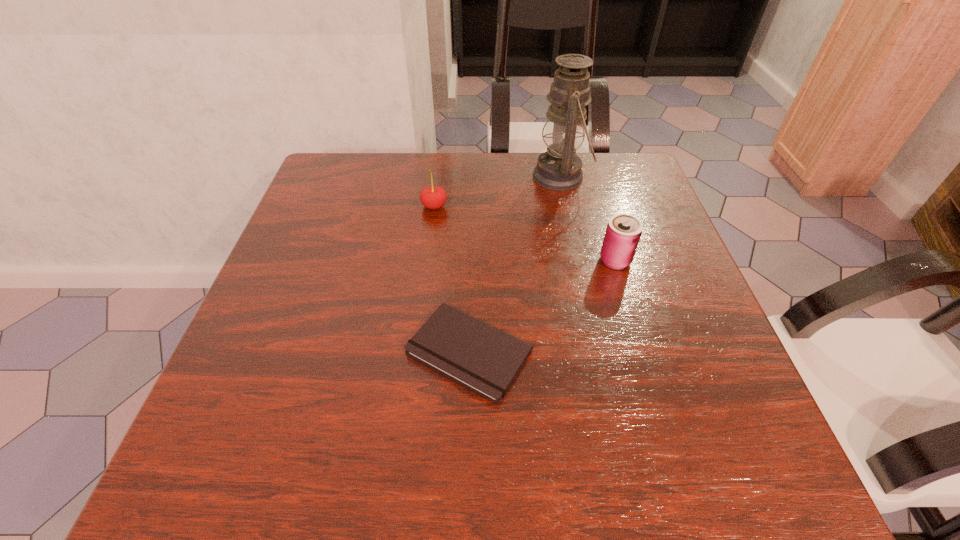
The image size is (960, 540). In order to click on the tallest object in this screenshot , I will do `click(559, 168)`.

I want to click on cherry, so click(x=433, y=197).

Find the location of a particular element. The height and width of the screenshot is (540, 960). can is located at coordinates (623, 232).

You are a GUI agent. You are given a task and a screenshot of the screen. Output one action in this format:
    pyautogui.click(x=<x>, y=<y>)
    Task: Click on the checkbook
    This screenshot has height=540, width=960.
    Given the screenshot: What is the action you would take?
    pyautogui.click(x=486, y=360)

This screenshot has width=960, height=540. I want to click on the shortest object, so click(x=486, y=360).

Where is `blank space located on the front of the oil lamp`? The image size is (960, 540). blank space located on the front of the oil lamp is located at coordinates (589, 303).

Where is `blank space located on the left of the cherry`? Image resolution: width=960 pixels, height=540 pixels. blank space located on the left of the cherry is located at coordinates (330, 206).

Find the location of a particular element. vacant space located 0.330m on the left of the third farthest object is located at coordinates (444, 260).

The image size is (960, 540). Find the location of `vacant space situated on the right of the checkbook`. vacant space situated on the right of the checkbook is located at coordinates (589, 351).

I want to click on oil lamp present at the far edge, so click(559, 168).